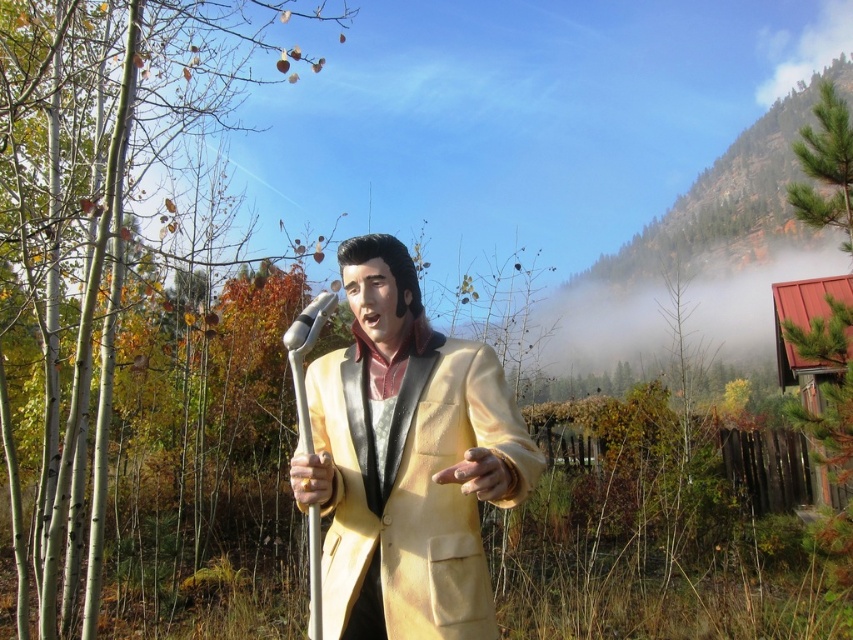
Question: Is the position of matte gold suit at center less distant than that of silver metallic microphone at center?

Choices:
 (A) no
 (B) yes

Answer: (B)

Question: Considering the real-world distances, which object is closest to the matte gold suit at center?

Choices:
 (A) golden metallic hand at center
 (B) silver metallic microphone at center
 (C) golden leather glove at center

Answer: (A)

Question: Which point is farther to the camera?

Choices:
 (A) (509, 476)
 (B) (323, 458)
 (C) (344, 579)
 (D) (337, 296)

Answer: (D)

Question: Which point appears closest to the camera in this image?

Choices:
 (A) (334, 592)
 (B) (335, 298)

Answer: (A)

Question: Is matte gold suit at center above golden leather glove at center?

Choices:
 (A) no
 (B) yes

Answer: (B)

Question: Is golden leather glove at center positioned in front of golden metallic hand at center?

Choices:
 (A) yes
 (B) no

Answer: (A)